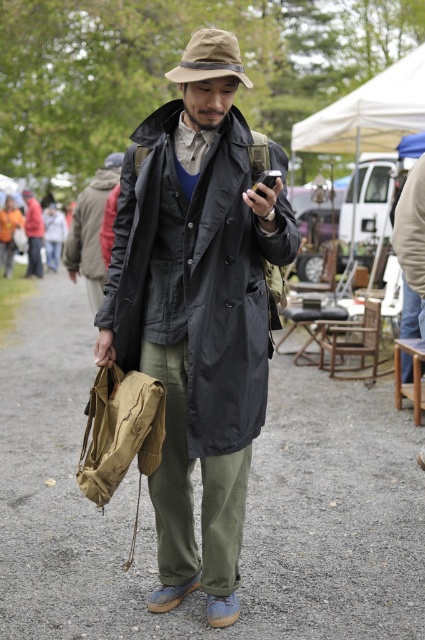
You are a photographer trying to capture the man in the matte black coat at center. The camera you are using has a limited field of view, so you need to know if the matte black coat at center is within the frame. The frame is defined by the corners at coordinates 0.0 to 1.0 in both x and y axes. Given that the point marking the matte black coat at center is at coordinate (x=198, y=276), will it be inside the frame?

The point marking the matte black coat at center is at coordinate (x=198, y=276), which falls within the frame boundaries of 0.0 to 1.0 in both x and y axes. Therefore, the matte black coat at center will be inside the frame.